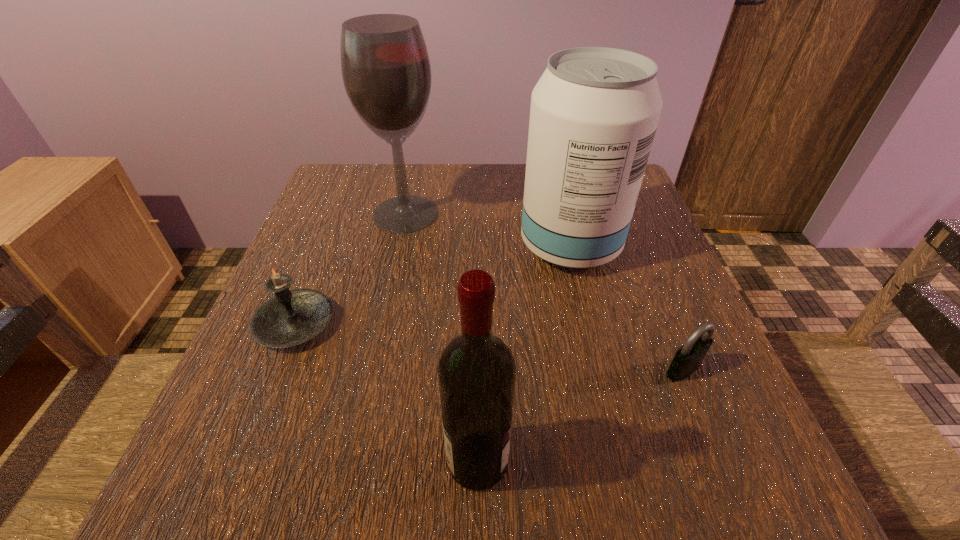
At what (x,y) coordinates should I click in order to perform the action: click on vacant space located 0.260m on the front and back of the third object from left to right. Please return your answer as a coordinate pair (x, y). The image size is (960, 540). Looking at the image, I should click on (695, 461).

Where is `blank space located on the back of the leftmost object`? blank space located on the back of the leftmost object is located at coordinates (327, 244).

Find the location of `vacant space located 0.370m on the left of the padlock`. vacant space located 0.370m on the left of the padlock is located at coordinates (439, 369).

Find the location of a particular element. This screenshot has height=540, width=960. object situated at the far edge is located at coordinates (386, 71).

Identify the location of object situated at the near edge. (476, 372).

The width and height of the screenshot is (960, 540). In order to click on alcohol located in the left edge section of the desktop in this screenshot , I will do `click(386, 71)`.

Find the location of a particular element. The image size is (960, 540). candle that is at the left edge is located at coordinates (292, 317).

Where is `alcohol that is at the right edge`? This screenshot has width=960, height=540. alcohol that is at the right edge is located at coordinates (594, 112).

The height and width of the screenshot is (540, 960). In order to click on padlock that is at the right edge in this screenshot , I will do `click(688, 358)`.

At what (x,y) coordinates should I click in order to perform the action: click on object at the far left corner. Please return your answer as a coordinate pair (x, y). Looking at the image, I should click on (386, 71).